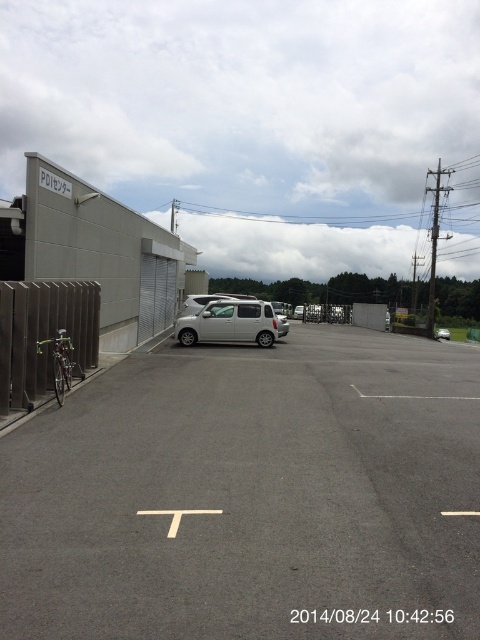
Question: Which point appears farthest from the camera in this image?

Choices:
 (A) (57, 371)
 (B) (216, 561)
 (C) (447, 337)

Answer: (C)

Question: Can you confirm if white matte van at center is wider than silver metallic car at center?

Choices:
 (A) yes
 (B) no

Answer: (B)

Question: Which object appears closest to the camera in this image?

Choices:
 (A) gray asphalt parking lot at left
 (B) satin silver van at center
 (C) silver metallic car at center

Answer: (A)

Question: Which point is closer to the camera taking this photo?

Choices:
 (A) (228, 314)
 (B) (437, 333)
 (C) (59, 360)

Answer: (C)

Question: Observing the image, what is the correct spatial positioning of satin silver van at center in reference to silver metallic car at center?

Choices:
 (A) left
 (B) right

Answer: (A)

Question: Does gray asphalt parking lot at left appear over white matte van at center?

Choices:
 (A) yes
 (B) no

Answer: (B)